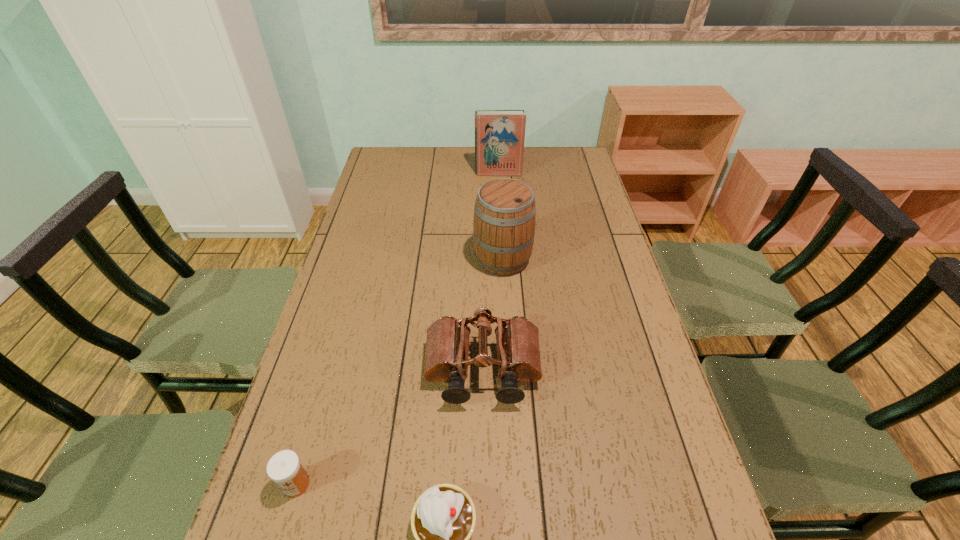
Locate an element on the screen. hardback book is located at coordinates click(x=499, y=134).

This screenshot has width=960, height=540. I want to click on the fourth nearest object, so click(x=504, y=223).

Identify the location of binoculars. (447, 346).

Locate an element on the screen. The image size is (960, 540). the third nearest object is located at coordinates (447, 346).

This screenshot has width=960, height=540. I want to click on medicine, so click(x=284, y=468).

This screenshot has width=960, height=540. Find the location of `vacant area situated on the cover of the farthest object`. vacant area situated on the cover of the farthest object is located at coordinates (499, 187).

Where is `free space located on the right of the cider`? This screenshot has width=960, height=540. free space located on the right of the cider is located at coordinates (575, 260).

Find the location of a particular element. Image resolution: width=960 pixels, height=540 pixels. vacant space located 0.250m through the eyepieces of the third farthest object is located at coordinates (484, 524).

Where is `vacant space situated 0.210m on the back of the medicine`? The image size is (960, 540). vacant space situated 0.210m on the back of the medicine is located at coordinates click(324, 385).

Locate an element on the screen. This screenshot has width=960, height=540. object that is at the far edge is located at coordinates (499, 134).